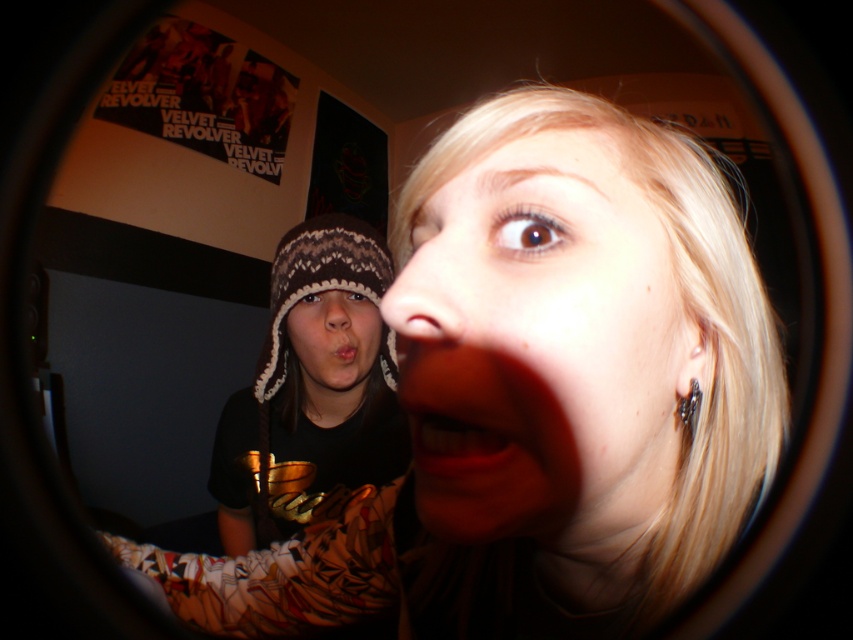
Is knitted woolen hat at center smaller than matte brown hat at upper left?

No, knitted woolen hat at center is not smaller than matte brown hat at upper left.

What do you see at coordinates (334, 342) in the screenshot? The image size is (853, 640). I see `knitted woolen hat at center` at bounding box center [334, 342].

Find the location of `knitted woolen hat at center`. knitted woolen hat at center is located at coordinates (334, 342).

Is smooth skin face at center smaller than matte skin nose at center?

No.

Is smooth skin face at center positioned in front of matte skin nose at center?

That is False.

Who is more distant from viewer, (456, 442) or (444, 307)?

The point (456, 442) is more distant.

Where is `smooth skin face at center`? This screenshot has width=853, height=640. smooth skin face at center is located at coordinates (543, 349).

Is matte black hat at upper left positioned in front of matte skin nose at center?

No, matte black hat at upper left is behind matte skin nose at center.

Can you confirm if matte black hat at upper left is smaller than matte skin nose at center?

No, matte black hat at upper left is not smaller than matte skin nose at center.

What do you see at coordinates (549, 397) in the screenshot? This screenshot has height=640, width=853. I see `matte black hat at upper left` at bounding box center [549, 397].

Find the location of a particular element. The image size is (853, 640). matte black hat at upper left is located at coordinates (549, 397).